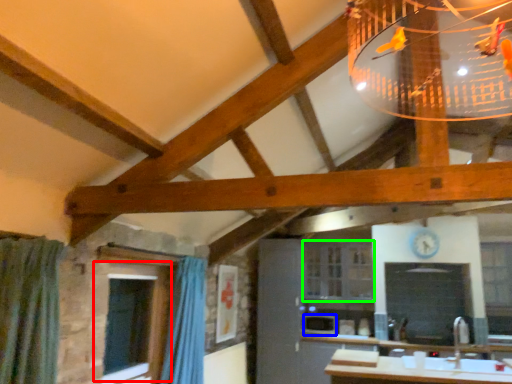
Question: Which is farther away from window (highlighted by a red box)? appliance (highlighted by a blue box) or window (highlighted by a green box)?

Choices:
 (A) appliance
 (B) window

Answer: (B)